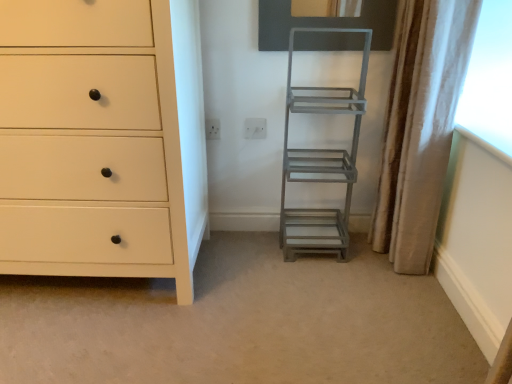
I want to click on free spot in front of gray matte metal ladder at center-right, so click(338, 287).